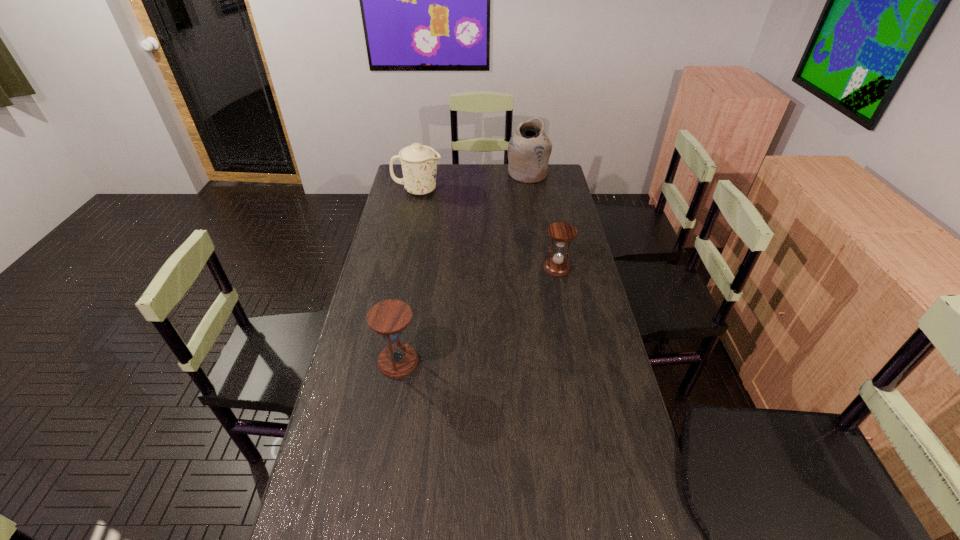
The image size is (960, 540). I want to click on vacant space at the right edge, so click(x=630, y=521).

Locate an element on the screen. empty space between the shorter hourglass and the nearer hourglass is located at coordinates (477, 315).

Identify the location of empty space between the chinaware and the pottery. (472, 182).

Where is `vacant space that is in between the third farthest object and the pottery`? vacant space that is in between the third farthest object and the pottery is located at coordinates (542, 221).

Image resolution: width=960 pixels, height=540 pixels. What are the coordinates of `free space between the left hourglass and the pottery` in the screenshot? It's located at (463, 267).

Find the location of a particular element. unoccupied area between the pottery and the left hourglass is located at coordinates (463, 267).

This screenshot has width=960, height=540. In order to click on unoccupied area between the chinaware and the nearest object in this screenshot , I will do `click(408, 276)`.

You are a GUI agent. You are given a task and a screenshot of the screen. Output one action in this format:
    pyautogui.click(x=<x>, y=<y>)
    Task: Click on the free space between the pottery and the left hourglass
    The height and width of the screenshot is (540, 960).
    Given the screenshot: What is the action you would take?
    pyautogui.click(x=463, y=267)

Identify the location of empty space between the nearest object and the pottery. Image resolution: width=960 pixels, height=540 pixels. (463, 267).

Locate which object is the second closest to the pottery. Please provide its 2D coordinates. Your answer should be formatted as a tuple, i.e. [(x, y)], where the tuple contains the x and y coordinates of a point satisfying the conditions above.

[(557, 266)]